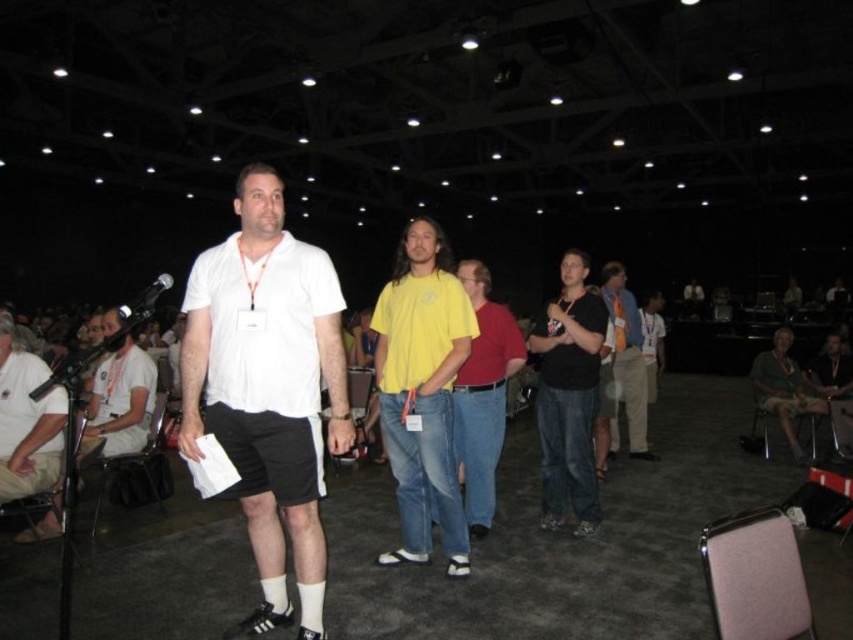
You are an event organizer who needs to arrange a photo shoot. You have to position the black matte shirt at center and the light brown leather chair at lower right in the frame. Which object should you place closer to the camera to make them appear the same size in the photo?

To make the black matte shirt at center and the light brown leather chair at lower right appear the same size in the photo, you should place the black matte shirt at center closer to the camera since it is smaller than the light brown leather chair at lower right.